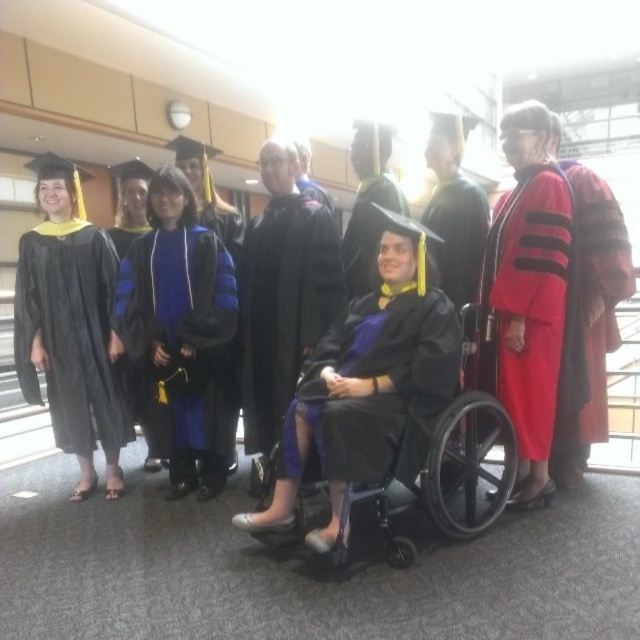
Question: Which is nearer to the matte black gown at center?

Choices:
 (A) matte black gown at left
 (B) black matte coat at center
 (C) blue velvet gown at center

Answer: (B)

Question: Is matte black gown at center thinner than red velvet graduation gown at right?

Choices:
 (A) yes
 (B) no

Answer: (A)

Question: Which object appears farthest from the camera in this image?

Choices:
 (A) matte black gown at left
 (B) blue velvet gown at center

Answer: (A)

Question: Is red velvet graduation gown at right to the right of matte black graduation gown at center from the viewer's perspective?

Choices:
 (A) no
 (B) yes

Answer: (B)

Question: Is black matte coat at center above black plastic wheelchair at center?

Choices:
 (A) yes
 (B) no

Answer: (A)

Question: Which of these objects is positioned closest to the blue velvet gown at center?

Choices:
 (A) matte black graduation gown at center
 (B) red velvet graduation gown at right
 (C) matte black gown at center

Answer: (C)